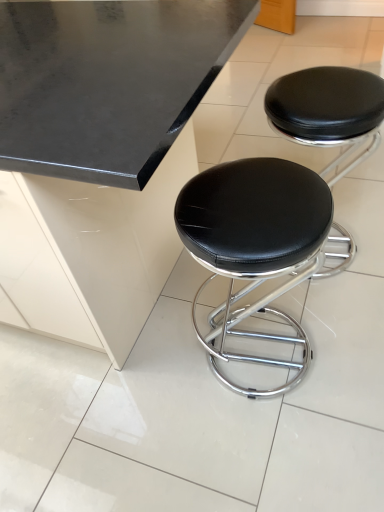
Image resolution: width=384 pixels, height=512 pixels. What do you see at coordinates (255, 245) in the screenshot?
I see `black leather stool at center, positioned as the 2th stool in right-to-left order` at bounding box center [255, 245].

In order to face black leather stool at center, positioned as the 2th stool in right-to-left order, should I rotate leftwards or rightwards?

To align with it, rotate right about 7.609°.

Measure the distance between point (292, 362) and camera.

The distance of point (292, 362) from camera is 1.45 meters.

The width and height of the screenshot is (384, 512). I want to click on black leather stool at center, positioned as the 2th stool in right-to-left order, so click(x=255, y=245).

Describe the element at coordinates (328, 111) in the screenshot. The height and width of the screenshot is (512, 384). I see `black leather stool at center, which ranks as the 1th stool in right-to-left order` at that location.

Image resolution: width=384 pixels, height=512 pixels. I want to click on black leather stool at center, which ranks as the 1th stool in right-to-left order, so click(328, 111).

Measure the distance between point (295, 76) and camera.

Point (295, 76) is 1.35 meters from camera.

The image size is (384, 512). Find the location of `black leather stool at center, the first stool in the left-to-right sequence`. black leather stool at center, the first stool in the left-to-right sequence is located at coordinates (255, 245).

Which is more to the left, black leather stool at center, positioned as the second stool in left-to-right order, or black leather stool at center, positioned as the 2th stool in right-to-left order?

From the viewer's perspective, black leather stool at center, positioned as the 2th stool in right-to-left order, appears more on the left side.

Is black leather stool at center, which ranks as the 1th stool in right-to-left order, in front of black leather stool at center, positioned as the 2th stool in right-to-left order?

No, it is behind black leather stool at center, positioned as the 2th stool in right-to-left order.

Which point is more distant from viewer, (353,104) or (187,234)?

Positioned behind is point (353,104).

From the image's perspective, would you say black leather stool at center, positioned as the second stool in left-to-right order, is positioned over black leather stool at center, the first stool in the left-to-right sequence?

Yes, from the image's perspective, black leather stool at center, positioned as the second stool in left-to-right order, is above black leather stool at center, the first stool in the left-to-right sequence.

From a real-world perspective, is black leather stool at center, which ranks as the 1th stool in right-to-left order, physically below black leather stool at center, the first stool in the left-to-right sequence?

Yes, from a real-world perspective, black leather stool at center, which ranks as the 1th stool in right-to-left order, is beneath black leather stool at center, the first stool in the left-to-right sequence.

Which object is thinner, black leather stool at center, positioned as the second stool in left-to-right order, or black leather stool at center, the first stool in the left-to-right sequence?

With smaller width is black leather stool at center, the first stool in the left-to-right sequence.

Between black leather stool at center, which ranks as the 1th stool in right-to-left order, and black leather stool at center, positioned as the 2th stool in right-to-left order, which one has less height?

With less height is black leather stool at center, positioned as the 2th stool in right-to-left order.

Does black leather stool at center, which ranks as the 1th stool in right-to-left order, have a smaller size compared to black leather stool at center, the first stool in the left-to-right sequence?

Incorrect, black leather stool at center, which ranks as the 1th stool in right-to-left order, is not smaller in size than black leather stool at center, the first stool in the left-to-right sequence.

Can black leather stool at center, the first stool in the left-to-right sequence, be found inside black leather stool at center, positioned as the second stool in left-to-right order?

No, black leather stool at center, the first stool in the left-to-right sequence, is not a part of black leather stool at center, positioned as the second stool in left-to-right order.

Are black leather stool at center, positioned as the second stool in left-to-right order, and black leather stool at center, the first stool in the left-to-right sequence, located far from each other?

No, there isn't a large distance between black leather stool at center, positioned as the second stool in left-to-right order, and black leather stool at center, the first stool in the left-to-right sequence.

In the scene shown: Does black leather stool at center, positioned as the second stool in left-to-right order, turn towards black leather stool at center, the first stool in the left-to-right sequence?

No.

Locate an element on the screen. stool below the black leather stool at center, positioned as the second stool in left-to-right order (from the image's perspective) is located at coordinates (255, 245).

Between black leather stool at center, positioned as the 2th stool in right-to-left order, and black leather stool at center, which ranks as the 1th stool in right-to-left order, which one appears on the left side from the viewer's perspective?

black leather stool at center, positioned as the 2th stool in right-to-left order.

Which object is closer to the camera taking this photo, black leather stool at center, positioned as the 2th stool in right-to-left order, or black leather stool at center, positioned as the second stool in left-to-right order?

black leather stool at center, positioned as the 2th stool in right-to-left order, is more forward.

Between point (201, 174) and point (348, 74), which one is positioned in front?

Point (201, 174)

From the image's perspective, is black leather stool at center, the first stool in the left-to-right sequence, above or below black leather stool at center, positioned as the second stool in left-to-right order?

black leather stool at center, the first stool in the left-to-right sequence, is below black leather stool at center, positioned as the second stool in left-to-right order.

From a real-world perspective, is black leather stool at center, positioned as the 2th stool in right-to-left order, located beneath black leather stool at center, which ranks as the 1th stool in right-to-left order?

No.

Between black leather stool at center, the first stool in the left-to-right sequence, and black leather stool at center, which ranks as the 1th stool in right-to-left order, which one has larger width?

black leather stool at center, which ranks as the 1th stool in right-to-left order, is wider.

Between black leather stool at center, positioned as the 2th stool in right-to-left order, and black leather stool at center, positioned as the second stool in left-to-right order, which one has more height?

black leather stool at center, positioned as the second stool in left-to-right order.

Considering the relative sizes of black leather stool at center, the first stool in the left-to-right sequence, and black leather stool at center, which ranks as the 1th stool in right-to-left order, in the image provided, is black leather stool at center, the first stool in the left-to-right sequence, bigger than black leather stool at center, which ranks as the 1th stool in right-to-left order,?

No, black leather stool at center, the first stool in the left-to-right sequence, is not bigger than black leather stool at center, which ranks as the 1th stool in right-to-left order.

Does black leather stool at center, positioned as the 2th stool in right-to-left order, contain black leather stool at center, positioned as the second stool in left-to-right order?

No, black leather stool at center, positioned as the 2th stool in right-to-left order, does not contain black leather stool at center, positioned as the second stool in left-to-right order.

Is black leather stool at center, the first stool in the left-to-right sequence, in contact with black leather stool at center, positioned as the second stool in left-to-right order?

There is a gap between black leather stool at center, the first stool in the left-to-right sequence, and black leather stool at center, positioned as the second stool in left-to-right order.

Is black leather stool at center, the first stool in the left-to-right sequence, positioned with its back to black leather stool at center, positioned as the second stool in left-to-right order?

black leather stool at center, the first stool in the left-to-right sequence, is not turned away from black leather stool at center, positioned as the second stool in left-to-right order.

In the scene shown: How many degrees apart are the facing directions of black leather stool at center, the first stool in the left-to-right sequence, and black leather stool at center, positioned as the second stool in left-to-right order?

They differ by 4.7e-05 degrees in their facing directions.

Identify the location of stool located behind the black leather stool at center, the first stool in the left-to-right sequence. Image resolution: width=384 pixels, height=512 pixels. (328, 111).

The width and height of the screenshot is (384, 512). I want to click on stool below the black leather stool at center, positioned as the 2th stool in right-to-left order (from a real-world perspective), so click(x=328, y=111).

Where is `stool lying in front of the black leather stool at center, positioned as the second stool in left-to-right order`? This screenshot has height=512, width=384. stool lying in front of the black leather stool at center, positioned as the second stool in left-to-right order is located at coordinates (255, 245).